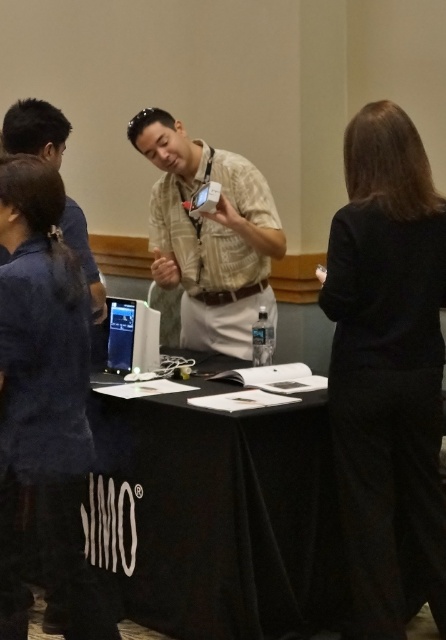
Who is more forward, (94, 552) or (21, 584)?

Point (21, 584) is more forward.

Does point (177, 515) come behind point (61, 314)?

Yes, it is.

Where is `black fabric table at center`? The image size is (446, 640). black fabric table at center is located at coordinates (214, 516).

In the scene shown: Is beige textured shirt at center thinner than dark blue shirt at upper left?

No, beige textured shirt at center is not thinner than dark blue shirt at upper left.

Can you confirm if beige textured shirt at center is smaller than dark blue shirt at upper left?

No, beige textured shirt at center is not smaller than dark blue shirt at upper left.

Is point (251, 358) positioned in front of point (50, 147)?

No, (251, 358) is further to viewer.

Find the location of `beige textured shirt at center`. beige textured shirt at center is located at coordinates (210, 234).

Who is more forward, (380, 218) or (198, 289)?

Point (380, 218)

Is black fabric skirt at lower right behind beige textured shirt at center?

That is False.

Which is behind, point (401, 260) or point (198, 330)?

The point (198, 330) is more distant.

The width and height of the screenshot is (446, 640). Find the location of `black fabric skirt at lower right`. black fabric skirt at lower right is located at coordinates (387, 364).